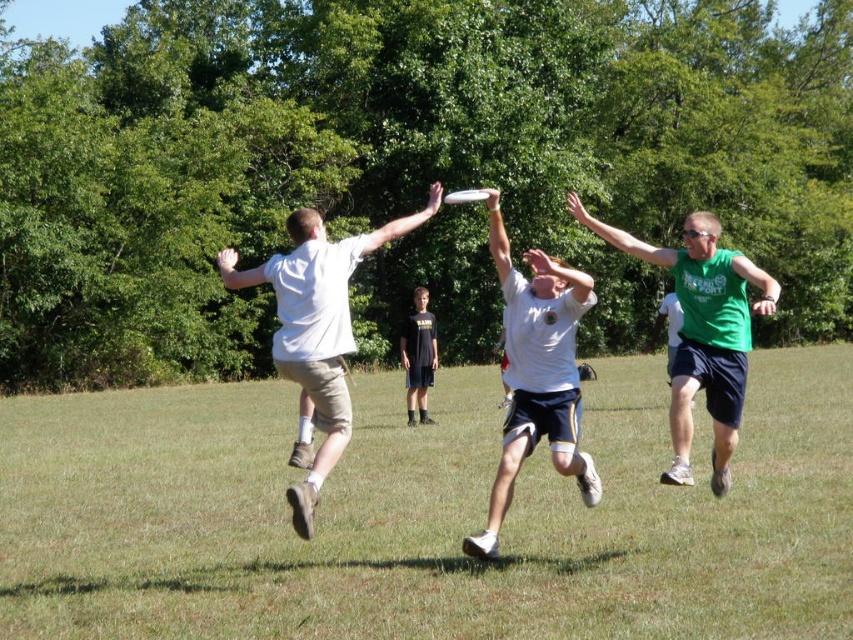
You are a photographer standing behind the players and want to capture a clear photo of the dark gray shorts at center without the green grass at center blocking the view. Is this possible?

The green grass at center is closer to the viewer than dark gray shorts at center, so the green grass at center would block the view of the dark gray shorts at center. Therefore, it is not possible to capture a clear photo of the dark gray shorts at center without the green grass at center blocking the view.

You are a photographer standing at the center of the field taking pictures of the ultimate frisbee game. You notice two points marked as point 1 at coordinates point (331, 385) and point 2 at coordinates point (634, 248). Which point is closer to your camera?

Point (331, 385) is closer to the camera than point (634, 248).

You are a player in the ultimate frisbee game and need to pass the frisbee to your teammate. You are currently holding the frisbee and see the white cotton shirt at center and the green sleeveless shirt at right. Which teammate is closer to you?

The white cotton shirt at center is closer to you since it is 2.59 meters away from the green sleeveless shirt at right, meaning the white cotton shirt at center is nearer.